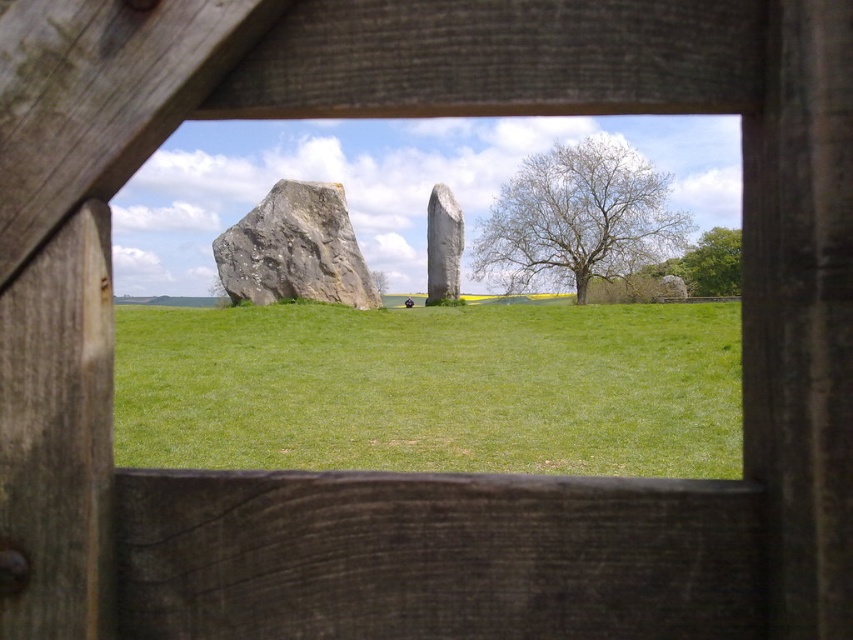
Question: Does bare wood tree at right have a smaller size compared to gray rough stone at left?

Choices:
 (A) yes
 (B) no

Answer: (B)

Question: Does transparent glass window at center appear over green leafy tree at upper right?

Choices:
 (A) yes
 (B) no

Answer: (B)

Question: Which of the following is the closest to the observer?

Choices:
 (A) (447, 205)
 (B) (740, 250)

Answer: (A)

Question: Which of the following is the farthest from the observer?

Choices:
 (A) (456, 246)
 (B) (308, 289)
 (C) (485, 420)

Answer: (A)

Question: Is transparent glass window at center smaller than smooth gray stone at center?

Choices:
 (A) yes
 (B) no

Answer: (B)

Question: Which object is positioned closest to the bare wood tree at right?

Choices:
 (A) gray rough stone at left
 (B) green grass at center
 (C) green leafy tree at upper right

Answer: (C)